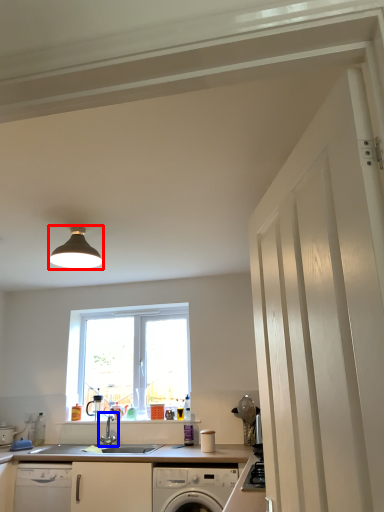
Question: Which of the following is the farthest to the observer, light fixture (highlighted by a red box) or tap (highlighted by a blue box)?

Choices:
 (A) light fixture
 (B) tap

Answer: (B)